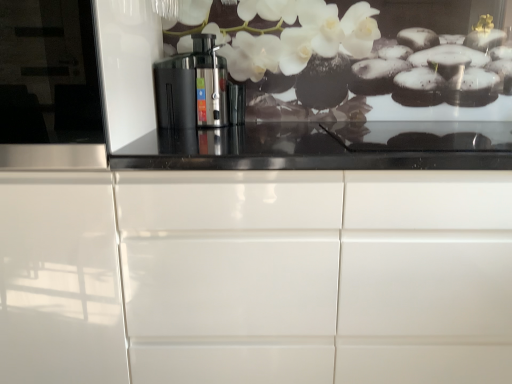
Describe the element at coordinates (192, 87) in the screenshot. I see `black plastic juicer at center` at that location.

Find the location of `white glossy cabinet at center`. white glossy cabinet at center is located at coordinates (256, 276).

Identify the location of black plastic juicer at center. The image size is (512, 384). (192, 87).

From the image's perspective, who appears lower, white glossy cabinet at center or transparent glossy glass door at left?

white glossy cabinet at center.

Considering the relative sizes of white glossy cabinet at center and transparent glossy glass door at left in the image provided, is white glossy cabinet at center bigger than transparent glossy glass door at left?

Correct, white glossy cabinet at center is larger in size than transparent glossy glass door at left.

Considering their positions, is white glossy cabinet at center located in front of or behind transparent glossy glass door at left?

Clearly, white glossy cabinet at center is behind transparent glossy glass door at left.

What's the angular difference between white glossy cabinet at center and transparent glossy glass door at left's facing directions?

The facing directions of white glossy cabinet at center and transparent glossy glass door at left are 1.5 degrees apart.

From the picture: Can you confirm if transparent glossy glass door at left is smaller than white glossy cabinet at center?

Correct, transparent glossy glass door at left occupies less space than white glossy cabinet at center.

Considering the sizes of transparent glossy glass door at left and white glossy cabinet at center in the image, is transparent glossy glass door at left taller or shorter than white glossy cabinet at center?

In the image, transparent glossy glass door at left appears to be shorter than white glossy cabinet at center.

From a real-world perspective, which object stands above the other?

transparent glossy glass door at left.

Looking at their sizes, would you say transparent glossy glass door at left is wider or thinner than white glossy cabinet at center?

In the image, transparent glossy glass door at left appears to be more narrow than white glossy cabinet at center.

How many degrees apart are the facing directions of black plastic juicer at center and transparent glossy glass door at left?

There is a 0.444-degree angle between the facing directions of black plastic juicer at center and transparent glossy glass door at left.

Which is more to the left, black plastic juicer at center or transparent glossy glass door at left?

transparent glossy glass door at left.

Who is shorter, black plastic juicer at center or transparent glossy glass door at left?

black plastic juicer at center is shorter.

From the image's perspective, is black plastic juicer at center positioned above or below transparent glossy glass door at left?

black plastic juicer at center is situated higher than transparent glossy glass door at left in the image.

Consider the image. From the image's perspective, between transparent glossy glass door at left and black plastic juicer at center, which one is located above?

black plastic juicer at center.

Is transparent glossy glass door at left looking in the opposite direction of black plastic juicer at center?

No, transparent glossy glass door at left's orientation is not away from black plastic juicer at center.

Between point (5, 23) and point (215, 109), which one is positioned in front?

Point (5, 23)

Which is closer to the camera, (200, 102) or (445, 357)?

The point (445, 357) is in front.

From a real-world perspective, relative to white glossy cabinet at center, is black plastic juicer at center vertically above or below?

From a real-world perspective, black plastic juicer at center is physically above white glossy cabinet at center.

Is black plastic juicer at center in front of or behind white glossy cabinet at center in the image?

Clearly, black plastic juicer at center is behind white glossy cabinet at center.

Measure the distance from black plastic juicer at center to white glossy cabinet at center.

The distance of black plastic juicer at center from white glossy cabinet at center is 24.61 inches.

Find the location of a particular element. Image resolution: width=512 pixels, height=384 pixels. home appliance located behind the white glossy cabinet at center is located at coordinates (192, 87).

Choose the correct answer: Is white glossy cabinet at center inside black plastic juicer at center or outside it?

white glossy cabinet at center is outside black plastic juicer at center.

In terms of width, does white glossy cabinet at center look wider or thinner when compared to black plastic juicer at center?

white glossy cabinet at center is wider than black plastic juicer at center.

Considering the sizes of objects white glossy cabinet at center and black plastic juicer at center in the image provided, who is taller, white glossy cabinet at center or black plastic juicer at center?

white glossy cabinet at center is taller.

Where is `glass door on the left of white glossy cabinet at center`? glass door on the left of white glossy cabinet at center is located at coordinates (49, 86).

Locate an element on the screen. This screenshot has height=384, width=512. glass door that appears above the white glossy cabinet at center (from the image's perspective) is located at coordinates (49, 86).

Based on their spatial positions, is white glossy cabinet at center or transparent glossy glass door at left closer to black plastic juicer at center?

The object closer to black plastic juicer at center is transparent glossy glass door at left.

Looking at the image, which one is located closer to white glossy cabinet at center, transparent glossy glass door at left or black plastic juicer at center?

The object closer to white glossy cabinet at center is transparent glossy glass door at left.

When comparing their distances from transparent glossy glass door at left, does white glossy cabinet at center or black plastic juicer at center seem closer?

Based on the image, white glossy cabinet at center appears to be nearer to transparent glossy glass door at left.

Considering their positions, is black plastic juicer at center positioned further to white glossy cabinet at center than transparent glossy glass door at left?

Based on the image, black plastic juicer at center appears to be further to white glossy cabinet at center.

Based on their spatial positions, is transparent glossy glass door at left or white glossy cabinet at center closer to black plastic juicer at center?

transparent glossy glass door at left is closer to black plastic juicer at center.

Looking at the image, which one is located further to transparent glossy glass door at left, black plastic juicer at center or white glossy cabinet at center?

black plastic juicer at center lies further to transparent glossy glass door at left than the other object.

Identify the location of home appliance between transparent glossy glass door at left and white glossy cabinet at center. The image size is (512, 384). (192, 87).